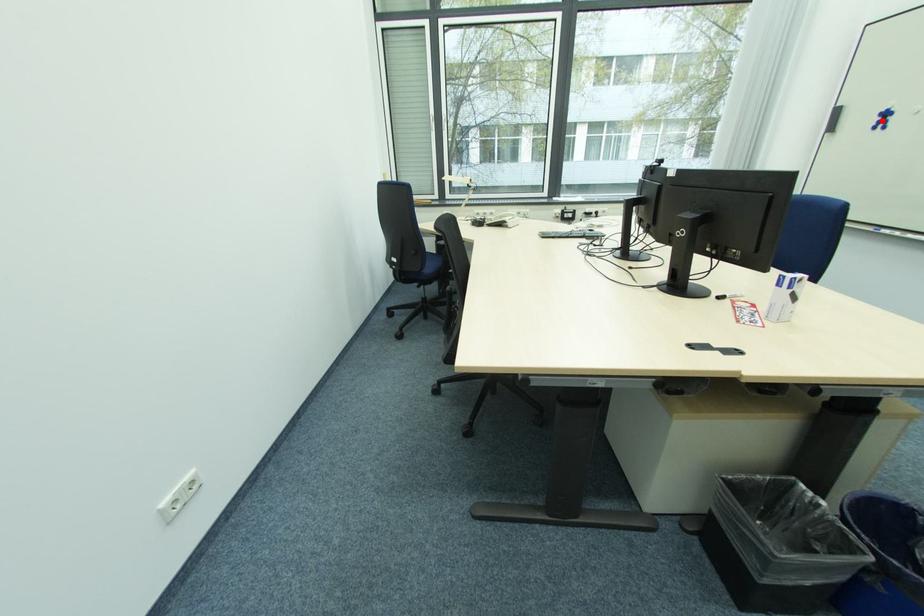
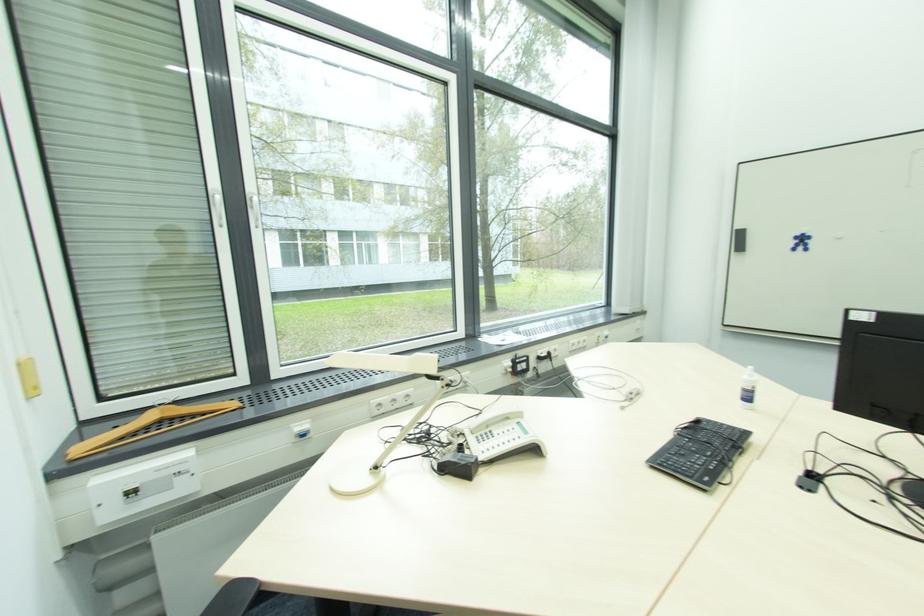
Where in the second image is the point corresponding to the highlighted location from the first image?

(801, 244)